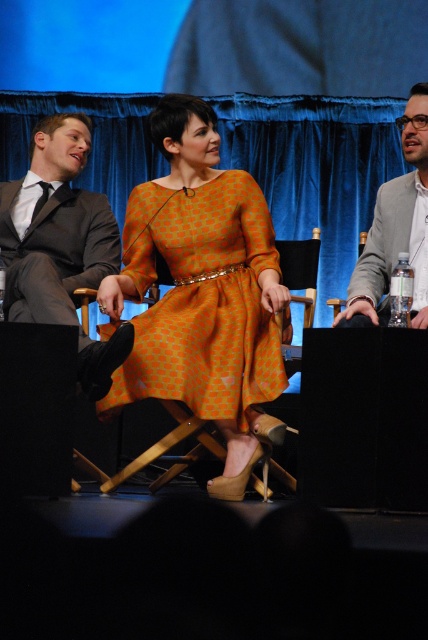
Can you confirm if orange printed dress at center is wider than dark gray suit at left?

Yes, orange printed dress at center is wider than dark gray suit at left.

Which of these two, orange printed dress at center or dark gray suit at left, stands shorter?

dark gray suit at left

Is point (166, 356) less distant than point (32, 236)?

Yes, it is.

Image resolution: width=428 pixels, height=640 pixels. What are the coordinates of `orange printed dress at center` in the screenshot? It's located at (202, 300).

Does blue velvet curtain at upper center appear under matte gray blazer at right?

No, blue velvet curtain at upper center is not below matte gray blazer at right.

Which of these two, blue velvet curtain at upper center or matte gray blazer at right, stands taller?

With more height is blue velvet curtain at upper center.

Between point (362, 122) and point (407, 202), which one is positioned behind?

The point (362, 122) is more distant.

The height and width of the screenshot is (640, 428). Find the location of `blue velvet curtain at upper center`. blue velvet curtain at upper center is located at coordinates (315, 168).

Is blue velvet curtain at upper center to the left of orange printed dress at center from the viewer's perspective?

In fact, blue velvet curtain at upper center is to the right of orange printed dress at center.

Does point (288, 211) come closer to viewer compared to point (252, 339)?

No, it is not.

Does point (293, 221) come closer to viewer compared to point (151, 205)?

No, (293, 221) is behind (151, 205).

Find the location of `blue velvet curtain at upper center`. blue velvet curtain at upper center is located at coordinates pyautogui.click(x=315, y=168).